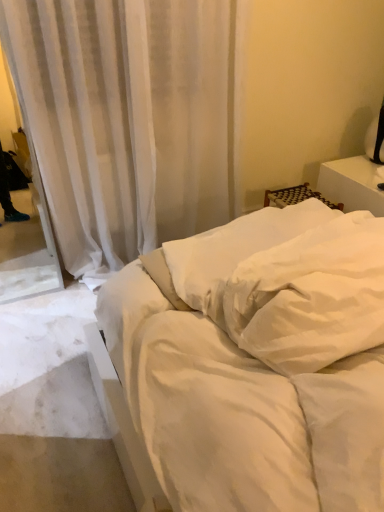
Question: From the image's perspective, is white soft pillow at center, placed as the second pillow when sorted from back to front, beneath white smooth bed at center?

Choices:
 (A) no
 (B) yes

Answer: (A)

Question: Can you confirm if white soft pillow at center, placed as the second pillow when sorted from back to front, is smaller than white smooth bed at center?

Choices:
 (A) no
 (B) yes

Answer: (B)

Question: Is white soft pillow at center, placed as the second pillow when sorted from back to front, oriented towards white smooth bed at center?

Choices:
 (A) no
 (B) yes

Answer: (A)

Question: Is white soft pillow at center, placed as the first pillow when sorted from front to back, closer to the viewer compared to white smooth bed at center?

Choices:
 (A) yes
 (B) no

Answer: (B)

Question: From the image's perspective, is white soft pillow at center, placed as the second pillow when sorted from back to front, on top of white smooth bed at center?

Choices:
 (A) no
 (B) yes

Answer: (B)

Question: Looking at the image, does white soft pillow at center, placed as the first pillow when sorted from front to back, seem bigger or smaller compared to white smooth bed at center?

Choices:
 (A) small
 (B) big

Answer: (A)

Question: Which is correct: white soft pillow at center, placed as the first pillow when sorted from front to back, is inside white smooth bed at center, or outside of it?

Choices:
 (A) inside
 (B) outside

Answer: (A)

Question: From the image's perspective, relative to white smooth bed at center, is white soft pillow at center, placed as the second pillow when sorted from back to front, above or below?

Choices:
 (A) above
 (B) below

Answer: (A)

Question: From a real-world perspective, is white soft pillow at center, placed as the first pillow when sorted from front to back, physically located above or below white smooth bed at center?

Choices:
 (A) above
 (B) below

Answer: (A)

Question: Is white soft pillow at center, the second pillow in the front-to-back sequence, bigger or smaller than white smooth bed at center?

Choices:
 (A) small
 (B) big

Answer: (A)

Question: In the image, is white soft pillow at center, the second pillow in the front-to-back sequence, positioned in front of or behind white smooth bed at center?

Choices:
 (A) behind
 (B) front

Answer: (A)

Question: From the image's perspective, is white soft pillow at center, the first pillow positioned from the back, positioned above or below white smooth bed at center?

Choices:
 (A) above
 (B) below

Answer: (A)

Question: Considering the relative positions of white soft pillow at center, the second pillow in the front-to-back sequence, and white smooth bed at center in the image provided, is white soft pillow at center, the second pillow in the front-to-back sequence, to the left or to the right of white smooth bed at center?

Choices:
 (A) left
 (B) right

Answer: (A)

Question: Looking at their shapes, would you say white smooth bed at center is wider or thinner than white soft pillow at center, placed as the second pillow when sorted from back to front?

Choices:
 (A) wide
 (B) thin

Answer: (A)

Question: Is point (225, 354) positioned closer to the camera than point (339, 281)?

Choices:
 (A) closer
 (B) farther

Answer: (B)